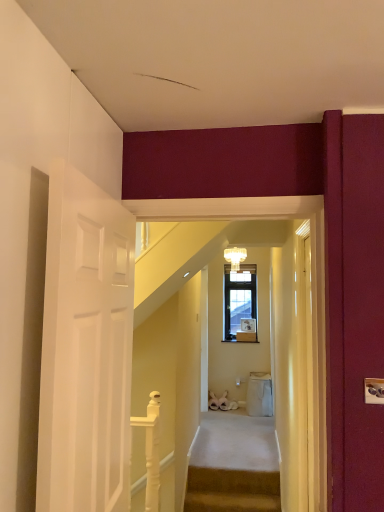
Question: From a real-world perspective, is white carpeted stairs at center, which is the 2th stairs in front-to-back order, located higher than white glossy balustrade at lower center?

Choices:
 (A) no
 (B) yes

Answer: (A)

Question: Can you confirm if white carpeted stairs at center, arranged as the 1th stairs when viewed from the top, is smaller than white glossy balustrade at lower center?

Choices:
 (A) no
 (B) yes

Answer: (A)

Question: Can you confirm if white carpeted stairs at center, arranged as the 1th stairs when viewed from the top, is taller than white glossy balustrade at lower center?

Choices:
 (A) yes
 (B) no

Answer: (B)

Question: Can you confirm if white carpeted stairs at center, arranged as the 1th stairs when viewed from the top, is bigger than white glossy balustrade at lower center?

Choices:
 (A) no
 (B) yes

Answer: (B)

Question: From the image's perspective, is white carpeted stairs at center, the 2th stairs in the bottom-to-top sequence, located beneath white glossy balustrade at lower center?

Choices:
 (A) no
 (B) yes

Answer: (B)

Question: Does white carpeted stairs at center, arranged as the 1th stairs when viewed from the top, have a greater width compared to white glossy balustrade at lower center?

Choices:
 (A) no
 (B) yes

Answer: (B)

Question: Considering the relative positions of white carpeted stairs at center, the 2th stairs in the bottom-to-top sequence, and carpeted stairs at center, the 1th stairs in the front-to-back sequence, in the image provided, is white carpeted stairs at center, the 2th stairs in the bottom-to-top sequence, to the right of carpeted stairs at center, the 1th stairs in the front-to-back sequence, from the viewer's perspective?

Choices:
 (A) yes
 (B) no

Answer: (A)

Question: Considering the relative positions of white carpeted stairs at center, the first stairs when ordered from back to front, and carpeted stairs at center, positioned as the 1th stairs in bottom-to-top order, in the image provided, is white carpeted stairs at center, the first stairs when ordered from back to front, to the left of carpeted stairs at center, positioned as the 1th stairs in bottom-to-top order, from the viewer's perspective?

Choices:
 (A) no
 (B) yes

Answer: (A)

Question: Is white carpeted stairs at center, which is the 2th stairs in front-to-back order, positioned before carpeted stairs at center, positioned as the 1th stairs in bottom-to-top order?

Choices:
 (A) yes
 (B) no

Answer: (B)

Question: From the image's perspective, is white carpeted stairs at center, the first stairs when ordered from back to front, beneath carpeted stairs at center, which is the second stairs in top-to-bottom order?

Choices:
 (A) yes
 (B) no

Answer: (B)

Question: Is white carpeted stairs at center, which is the 2th stairs in front-to-back order, completely or partially outside of carpeted stairs at center, positioned as the 1th stairs in bottom-to-top order?

Choices:
 (A) no
 (B) yes

Answer: (B)

Question: Can you confirm if white carpeted stairs at center, which is the 2th stairs in front-to-back order, is thinner than carpeted stairs at center, positioned as the second stairs in back-to-front order?

Choices:
 (A) yes
 (B) no

Answer: (B)

Question: From the image's perspective, does crystal glass chandelier at upper center appear higher than white carpeted stairs at center, the first stairs when ordered from back to front?

Choices:
 (A) yes
 (B) no

Answer: (A)